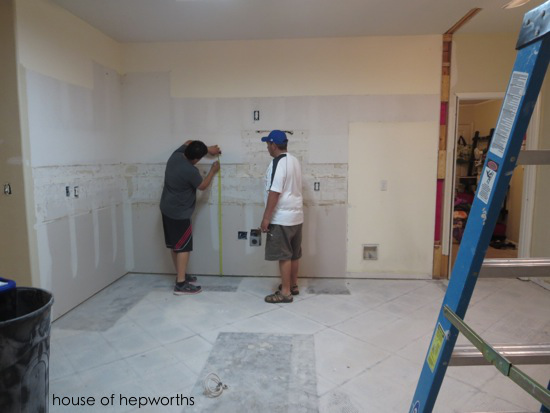
You are a GUI agent. You are given a task and a screenshot of the screen. Output one action in this format:
    pyautogui.click(x=<x>, y=<y>)
    Task: Click on the ladder
    The height and width of the screenshot is (413, 550).
    Given the screenshot: What is the action you would take?
    pyautogui.click(x=468, y=264)